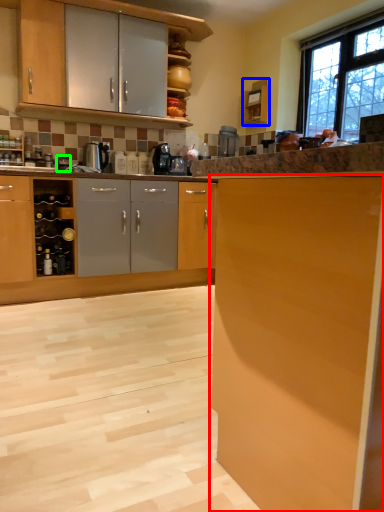
Question: Considering the real-world distances, which object is closest to cabinetry (highlighted by a red box)? cabinetry (highlighted by a blue box) or appliance (highlighted by a green box).

Choices:
 (A) cabinetry
 (B) appliance

Answer: (B)